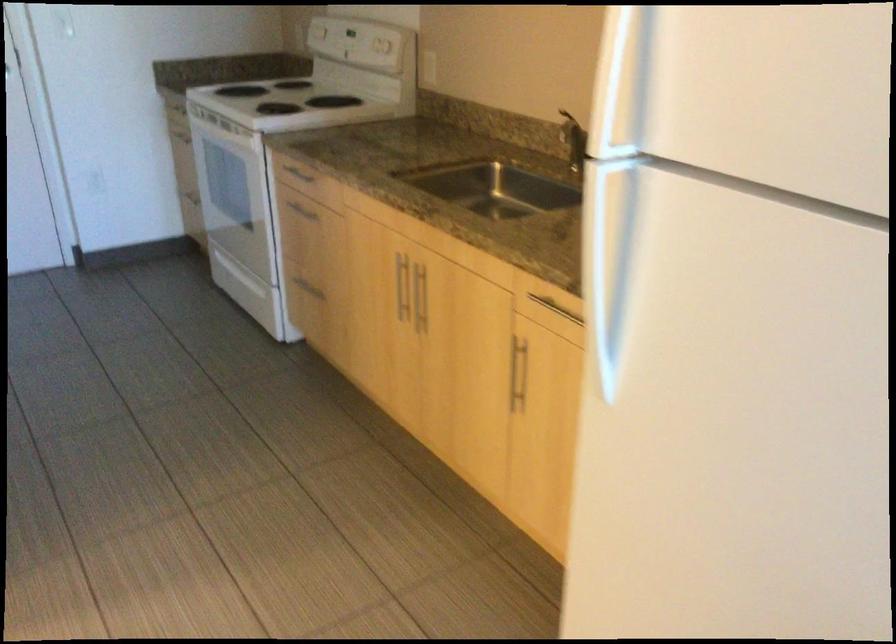
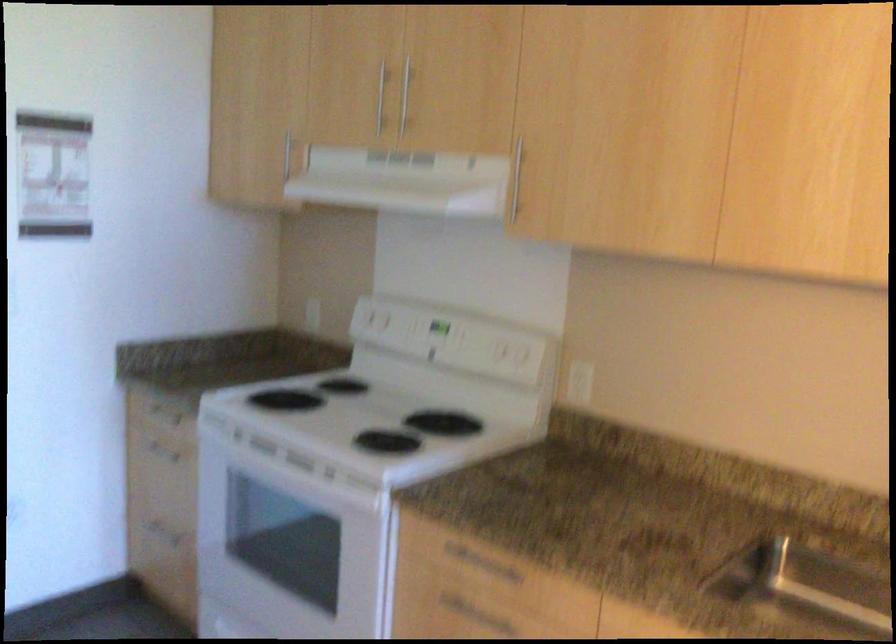
Where in the second image is the point corresponding to (298,211) from the first image?

(466, 609)